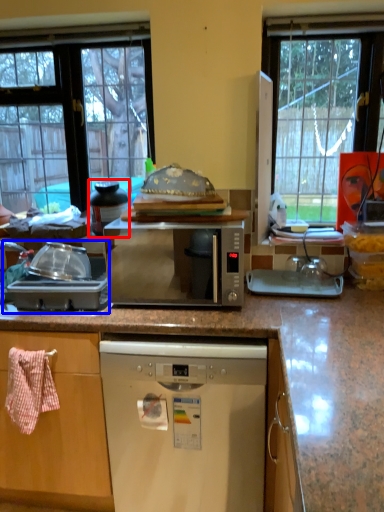
Question: Among these objects, which one is farthest to the camera, appliance (highlighted by a red box) or appliance (highlighted by a blue box)?

Choices:
 (A) appliance
 (B) appliance

Answer: (A)